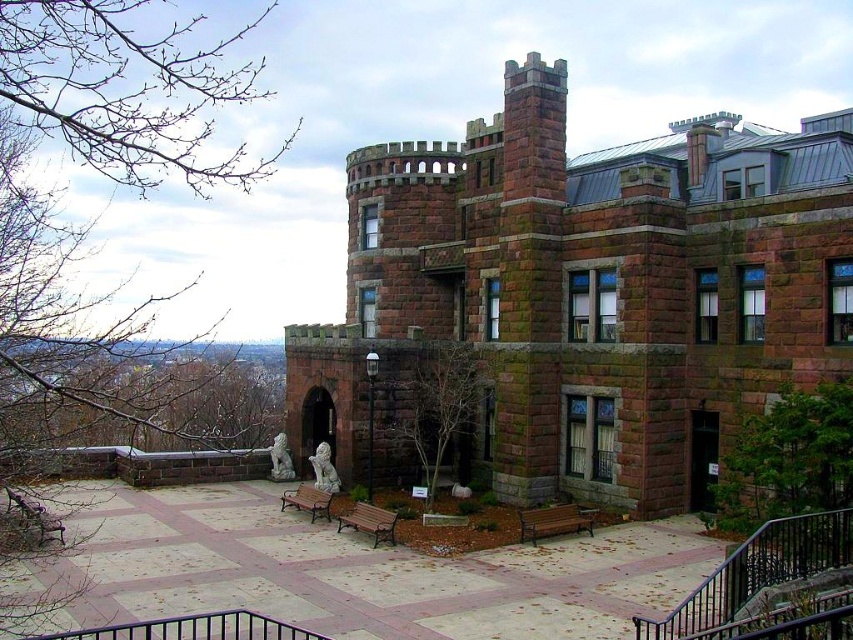
Looking at this image, who is taller, brown wooden bench at center or wooden bench at lower left?

wooden bench at lower left is taller.

Can you confirm if brown wooden bench at center is positioned to the left of wooden bench at lower left?

Incorrect, brown wooden bench at center is not on the left side of wooden bench at lower left.

Identify the location of brown wooden bench at center. (370, 522).

Looking at this image, which is more to the right, brown wooden bench at lower center or brown wooden bench at center?

brown wooden bench at lower center

Does brown wooden bench at lower center lie in front of brown wooden bench at center?

That is False.

Who is more forward, (573, 518) or (387, 513)?

Positioned in front is point (387, 513).

Locate an element on the screen. The height and width of the screenshot is (640, 853). brown wooden bench at lower center is located at coordinates (554, 522).

Can you confirm if brown stone castle at center is positioned to the right of wooden bench at lower left?

Correct, you'll find brown stone castle at center to the right of wooden bench at lower left.

Can you confirm if brown stone castle at center is thinner than wooden bench at lower left?

In fact, brown stone castle at center might be wider than wooden bench at lower left.

The image size is (853, 640). I want to click on brown stone castle at center, so click(582, 298).

Identify the location of brown stone castle at center. The height and width of the screenshot is (640, 853). (582, 298).